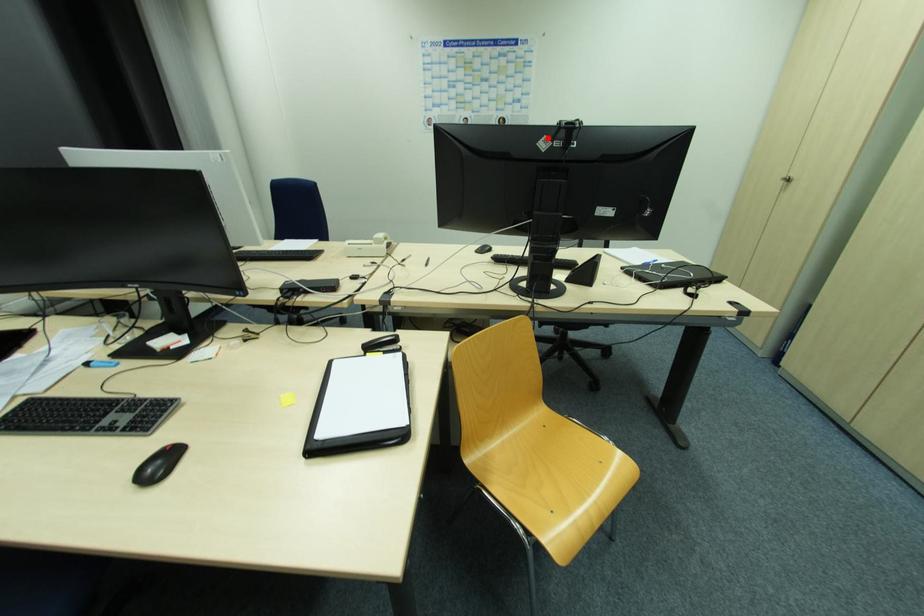
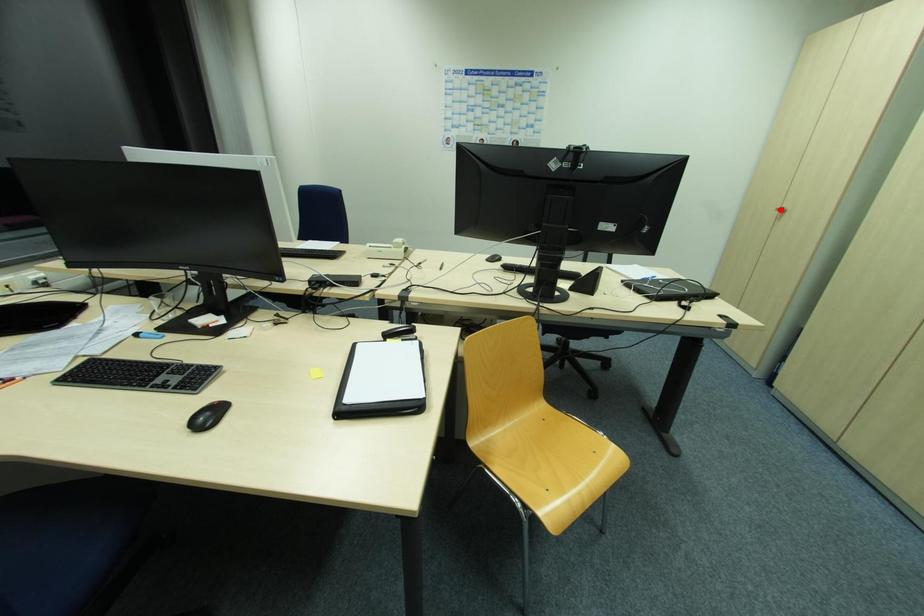
I am providing you with two images of the same scene from different viewpoints. A red point is marked on the first image and another point is marked on the second image. Do the highlighted points in image1 and image2 indicate the same real-world spot?

No